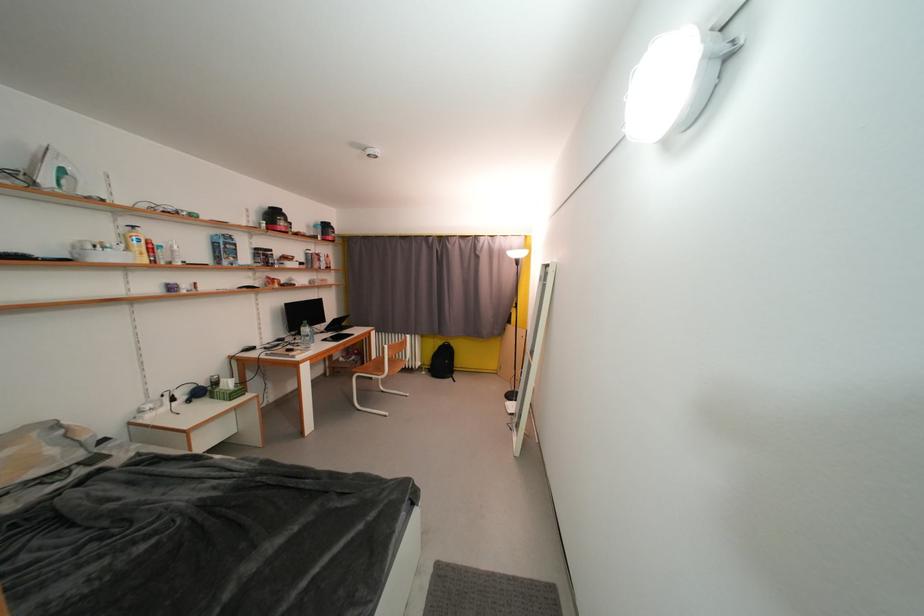
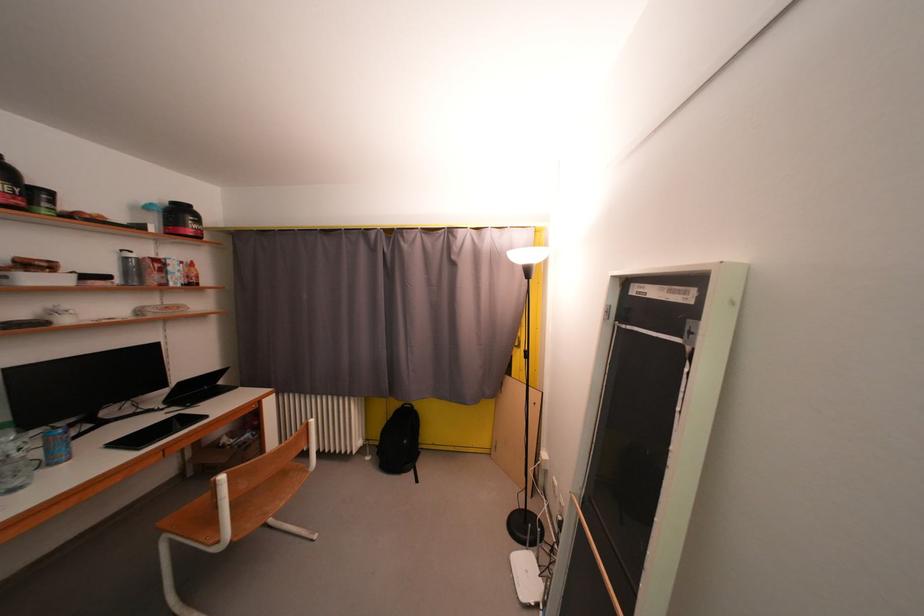
Question: What movement of the cameraman would produce the second image?

Choices:
 (A) Left
 (B) Right
 (C) Forward
 (D) Backward

Answer: (C)